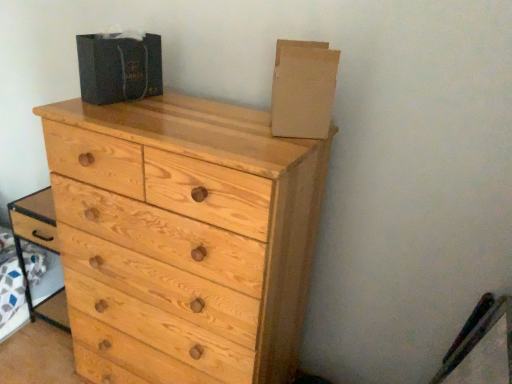
The height and width of the screenshot is (384, 512). Describe the element at coordinates (189, 228) in the screenshot. I see `light wood chest of drawers at center` at that location.

Describe the element at coordinates (119, 68) in the screenshot. I see `dark gray cardboard box at upper center, positioned as the 1th cardboard box in left-to-right order` at that location.

I want to click on light wood chest of drawers at center, so click(189, 228).

Identify the location of chest of drawers below the dark gray cardboard box at upper center, positioned as the 1th cardboard box in left-to-right order (from the image's perspective). This screenshot has height=384, width=512. point(189,228).

Looking at this image, is dark gray cardboard box at upper center, positioned as the 1th cardboard box in left-to-right order, positioned with its back to light wood chest of drawers at center?

dark gray cardboard box at upper center, positioned as the 1th cardboard box in left-to-right order, does not have its back to light wood chest of drawers at center.

From the image's perspective, between dark gray cardboard box at upper center, which is counted as the second cardboard box, starting from the right, and light wood chest of drawers at center, who is located below?

light wood chest of drawers at center appears lower in the image.

Which point is more distant from viewer, (130, 52) or (297, 77)?

The point (130, 52) is farther from the camera.

Choose the correct answer: Is dark gray cardboard box at upper center, which is counted as the second cardboard box, starting from the right, inside cardboard at upper right, which is counted as the 1th cardboard box, starting from the right, or outside it?

dark gray cardboard box at upper center, which is counted as the second cardboard box, starting from the right, is outside cardboard at upper right, which is counted as the 1th cardboard box, starting from the right.

Would you consider dark gray cardboard box at upper center, positioned as the 1th cardboard box in left-to-right order, to be distant from cardboard at upper right, which is counted as the 1th cardboard box, starting from the right?

They are positioned close to each other.

Who is bigger, dark gray cardboard box at upper center, which is counted as the second cardboard box, starting from the right, or cardboard at upper right, which is counted as the 1th cardboard box, starting from the right?

With larger size is dark gray cardboard box at upper center, which is counted as the second cardboard box, starting from the right.

The image size is (512, 384). Find the location of `cardboard box on the left of the cardboard at upper right, which is counted as the 1th cardboard box, starting from the right`. cardboard box on the left of the cardboard at upper right, which is counted as the 1th cardboard box, starting from the right is located at coordinates (119, 68).

From the image's perspective, which is above, cardboard at upper right, which is counted as the 1th cardboard box, starting from the right, or dark gray cardboard box at upper center, positioned as the 1th cardboard box in left-to-right order?

dark gray cardboard box at upper center, positioned as the 1th cardboard box in left-to-right order, appears higher in the image.

From a real-world perspective, which object stands above the other?

cardboard at upper right, placed as the 2th cardboard box when sorted from left to right.

From a real-world perspective, which object stands above the other?

From a 3D spatial view, cardboard at upper right, which is counted as the 1th cardboard box, starting from the right, is above.

Is cardboard at upper right, placed as the 2th cardboard box when sorted from left to right, located outside light wood chest of drawers at center?

cardboard at upper right, placed as the 2th cardboard box when sorted from left to right, is positioned outside light wood chest of drawers at center.

Measure the distance between cardboard at upper right, placed as the 2th cardboard box when sorted from left to right, and light wood chest of drawers at center.

cardboard at upper right, placed as the 2th cardboard box when sorted from left to right, and light wood chest of drawers at center are 38.53 centimeters apart.

Is cardboard at upper right, which is counted as the 1th cardboard box, starting from the right, looking in the opposite direction of light wood chest of drawers at center?

No.

Does light wood chest of drawers at center have a smaller size compared to dark gray cardboard box at upper center, positioned as the 1th cardboard box in left-to-right order?

Actually, light wood chest of drawers at center might be larger than dark gray cardboard box at upper center, positioned as the 1th cardboard box in left-to-right order.

Considering the positions of objects light wood chest of drawers at center and dark gray cardboard box at upper center, which is counted as the second cardboard box, starting from the right, in the image provided, who is in front, light wood chest of drawers at center or dark gray cardboard box at upper center, which is counted as the second cardboard box, starting from the right,?

light wood chest of drawers at center is closer to the camera.

Between light wood chest of drawers at center and dark gray cardboard box at upper center, which is counted as the second cardboard box, starting from the right, which one has larger width?

Wider between the two is light wood chest of drawers at center.

How many degrees apart are the facing directions of light wood chest of drawers at center and dark gray cardboard box at upper center, positioned as the 1th cardboard box in left-to-right order?

The angle between the facing direction of light wood chest of drawers at center and the facing direction of dark gray cardboard box at upper center, positioned as the 1th cardboard box in left-to-right order, is 12.5 degrees.

Is light wood chest of drawers at center spatially inside cardboard at upper right, which is counted as the 1th cardboard box, starting from the right, or outside of it?

light wood chest of drawers at center is not enclosed by cardboard at upper right, which is counted as the 1th cardboard box, starting from the right.

How many degrees apart are the facing directions of light wood chest of drawers at center and cardboard at upper right, placed as the 2th cardboard box when sorted from left to right?

The angular difference between light wood chest of drawers at center and cardboard at upper right, placed as the 2th cardboard box when sorted from left to right, is 63.9 degrees.

In terms of width, does light wood chest of drawers at center look wider or thinner when compared to cardboard at upper right, which is counted as the 1th cardboard box, starting from the right?

Clearly, light wood chest of drawers at center has more width compared to cardboard at upper right, which is counted as the 1th cardboard box, starting from the right.

Is light wood chest of drawers at center touching cardboard at upper right, placed as the 2th cardboard box when sorted from left to right?

No, light wood chest of drawers at center is not beside cardboard at upper right, placed as the 2th cardboard box when sorted from left to right.

The height and width of the screenshot is (384, 512). In order to click on the chest of drawers below the dark gray cardboard box at upper center, which is counted as the second cardboard box, starting from the right (from the image's perspective) in this screenshot , I will do `click(189, 228)`.

Find the location of a particular element. Image resolution: width=512 pixels, height=384 pixels. cardboard box beneath the cardboard at upper right, placed as the 2th cardboard box when sorted from left to right (from a real-world perspective) is located at coordinates (119, 68).

Looking at the image, which one is located further to cardboard at upper right, which is counted as the 1th cardboard box, starting from the right, dark gray cardboard box at upper center, which is counted as the second cardboard box, starting from the right, or light wood chest of drawers at center?

dark gray cardboard box at upper center, which is counted as the second cardboard box, starting from the right.

Considering their positions, is light wood chest of drawers at center positioned further to cardboard at upper right, placed as the 2th cardboard box when sorted from left to right, than dark gray cardboard box at upper center, positioned as the 1th cardboard box in left-to-right order?

The object further to cardboard at upper right, placed as the 2th cardboard box when sorted from left to right, is dark gray cardboard box at upper center, positioned as the 1th cardboard box in left-to-right order.

When comparing their distances from dark gray cardboard box at upper center, positioned as the 1th cardboard box in left-to-right order, does light wood chest of drawers at center or cardboard at upper right, which is counted as the 1th cardboard box, starting from the right, seem closer?

light wood chest of drawers at center lies closer to dark gray cardboard box at upper center, positioned as the 1th cardboard box in left-to-right order, than the other object.

Based on their spatial positions, is cardboard at upper right, placed as the 2th cardboard box when sorted from left to right, or dark gray cardboard box at upper center, which is counted as the second cardboard box, starting from the right, further from light wood chest of drawers at center?

Among the two, dark gray cardboard box at upper center, which is counted as the second cardboard box, starting from the right, is located further to light wood chest of drawers at center.

When comparing their distances from light wood chest of drawers at center, does dark gray cardboard box at upper center, which is counted as the second cardboard box, starting from the right, or cardboard at upper right, which is counted as the 1th cardboard box, starting from the right, seem closer?

Based on the image, cardboard at upper right, which is counted as the 1th cardboard box, starting from the right, appears to be nearer to light wood chest of drawers at center.

Estimate the real-world distances between objects in this image. Which object is closer to dark gray cardboard box at upper center, positioned as the 1th cardboard box in left-to-right order, cardboard at upper right, placed as the 2th cardboard box when sorted from left to right, or light wood chest of drawers at center?

light wood chest of drawers at center.

This screenshot has width=512, height=384. What are the coordinates of `cardboard box that lies between dark gray cardboard box at upper center, positioned as the 1th cardboard box in left-to-right order, and light wood chest of drawers at center from top to bottom` in the screenshot? It's located at (303, 89).